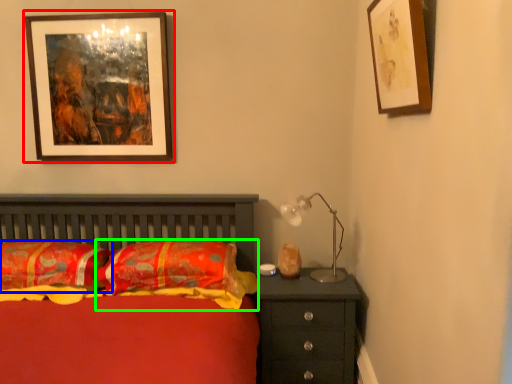
Question: Estimate the real-world distances between objects in this image. Which object is farther from picture frame (highlighted by a red box), pillow (highlighted by a blue box) or pillow (highlighted by a green box)?

Choices:
 (A) pillow
 (B) pillow

Answer: (B)